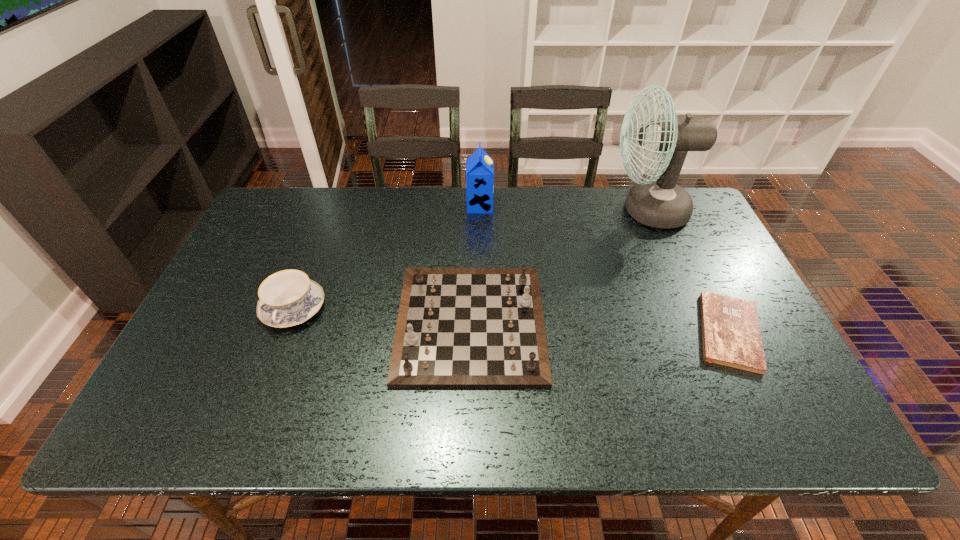
Find the location of `vacant space situated 0.060m on the board of the chessboard`. vacant space situated 0.060m on the board of the chessboard is located at coordinates (567, 323).

Find the location of a particular element. vacant space located on the left of the shortest object is located at coordinates (529, 332).

At what (x,y) coordinates should I click in order to perform the action: click on fan located at the far edge. Please return your answer as a coordinate pair (x, y). Looking at the image, I should click on (659, 203).

Where is `carton at the far edge`? Image resolution: width=960 pixels, height=540 pixels. carton at the far edge is located at coordinates (479, 166).

I want to click on object that is positioned at the left edge, so click(x=287, y=298).

This screenshot has width=960, height=540. I want to click on fan located at the right edge, so click(659, 203).

Where is `Bible at the right edge`? The image size is (960, 540). Bible at the right edge is located at coordinates (731, 336).

Find the location of `object present at the far right corner`. object present at the far right corner is located at coordinates (659, 203).

This screenshot has width=960, height=540. Identify the location of free space at the far edge of the desktop. (526, 216).

In the image, there is a desktop. Where is `vacant space at the near edge`? vacant space at the near edge is located at coordinates (507, 436).